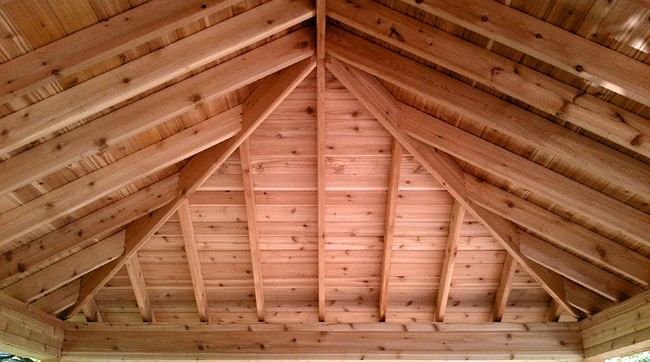
Where is `vertical beams`? vertical beams is located at coordinates (322, 173), (387, 222), (450, 263), (504, 288), (554, 312), (255, 266), (196, 266), (138, 289), (86, 312).